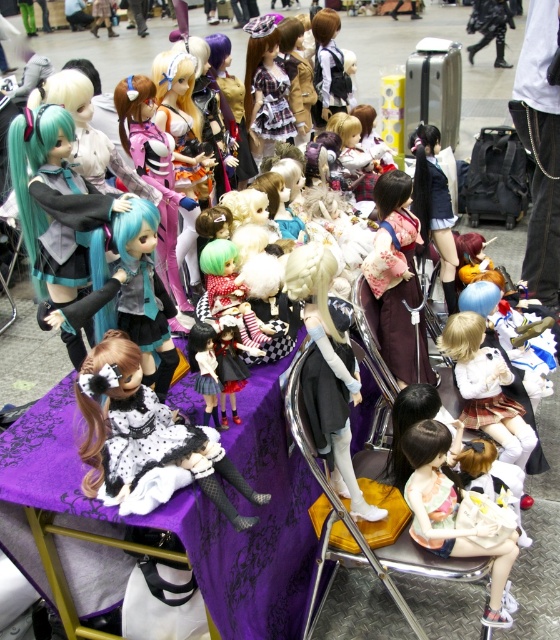
Based on the photo, you are organizing a doll display and need to ensure that all items fit on a small shelf. Given the teal matte wig at center and the black leather boots at upper right, which item should you place first to optimize space?

The teal matte wig at center should be placed first because it occupies less space than the black leather boots at upper right, allowing more room for the larger item afterward.

You are a photographer at the convention and want to capture a closeup of the doll at point [100,492] and the one at point [422,451]. Which doll will appear larger in the photo?

The doll at point [100,492] will appear larger in the photo because it is closer to the camera than the doll at point [422,451].